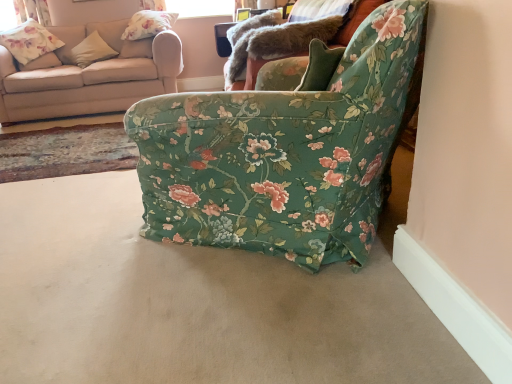
Image resolution: width=512 pixels, height=384 pixels. Identify the location of empty space that is ontop of beige carpet at lower center (from a real-world perspective). (221, 337).